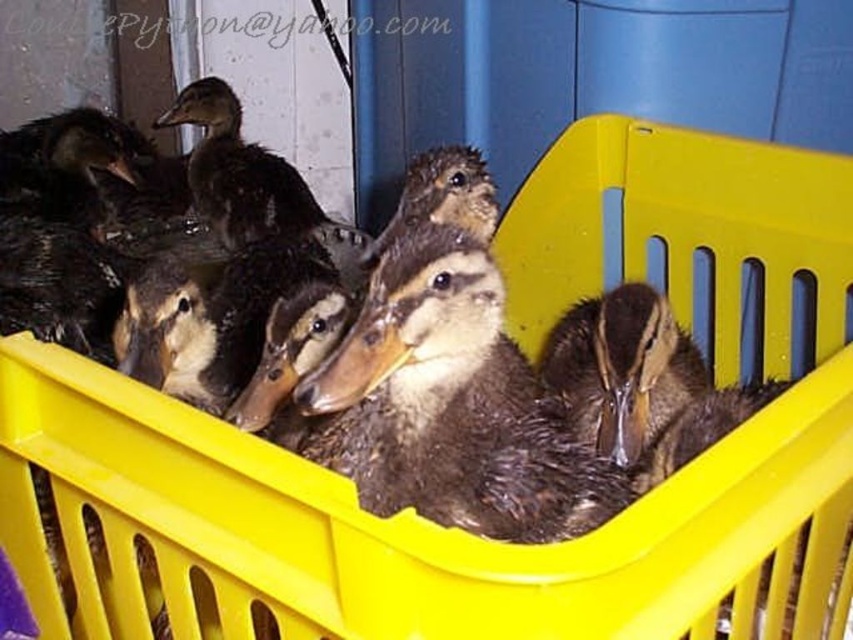
You are a veterinarian examining ducklings in a bright yellow plastic crate. You notice two groups of dark brown feathers at center and dark brown feathers at upper center. Which group of feathers is wider?

The dark brown feathers at upper center is wider than the dark brown feathers at center.

You are a veterinarian examining the ducklings in the crate. You notice two areas with dark brown feathers at center and dark brown feathers at upper center. Which area has ducklings with shorter feathers?

The dark brown feathers at center has ducklings with shorter feathers compared to the dark brown feathers at upper center.

You are a caretaker looking at the ducklings in the yellow plastic crate against the blue wall. You need to identify which of the dark brown feathers at center and dark brown feathers at upper center is closer to you. Which one is closer?

The dark brown feathers at center is closer to you because it is in front of the dark brown feathers at upper center.